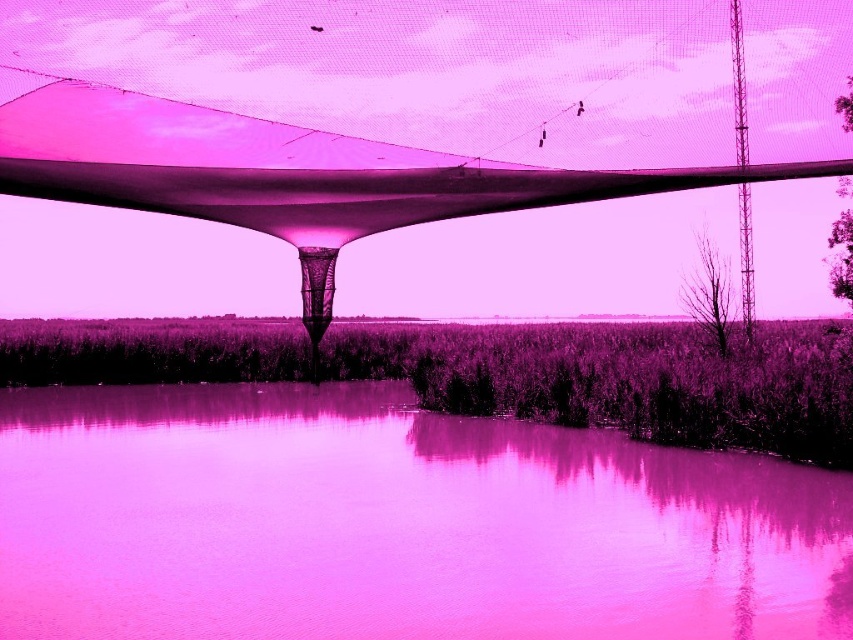
You are standing on a boat in the middle of the water and looking up at the transparent fabric canopy at center. Can you see the pink glossy water at lower center from your current position?

The pink glossy water at lower center is below the transparent fabric canopy at center, so yes, you can see the pink glossy water at lower center through the transparent fabric canopy at center.

You are a photographer trying to capture the pink glossy water at lower center and the transparent fabric canopy at center in the same frame. Which object will appear smaller in the photo?

The pink glossy water at lower center will appear smaller because it is not as tall as the transparent fabric canopy at center.

You are standing in this surreal purple landscape and want to take a photo of both the pink glossy water at lower center and the transparent fabric canopy at center. Which object will appear larger in your photo?

The pink glossy water at lower center will appear larger in the photo because it is closer to the viewer than the transparent fabric canopy at center.